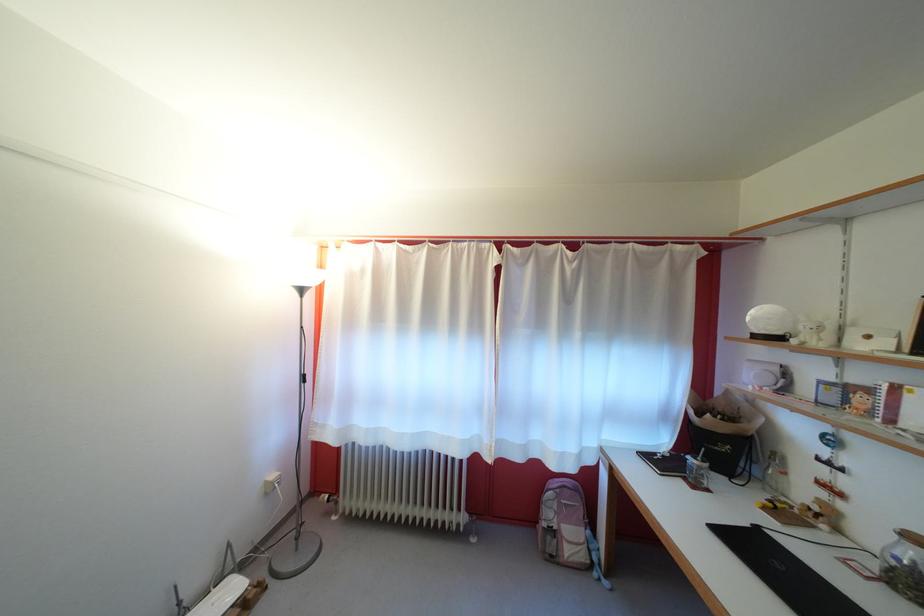
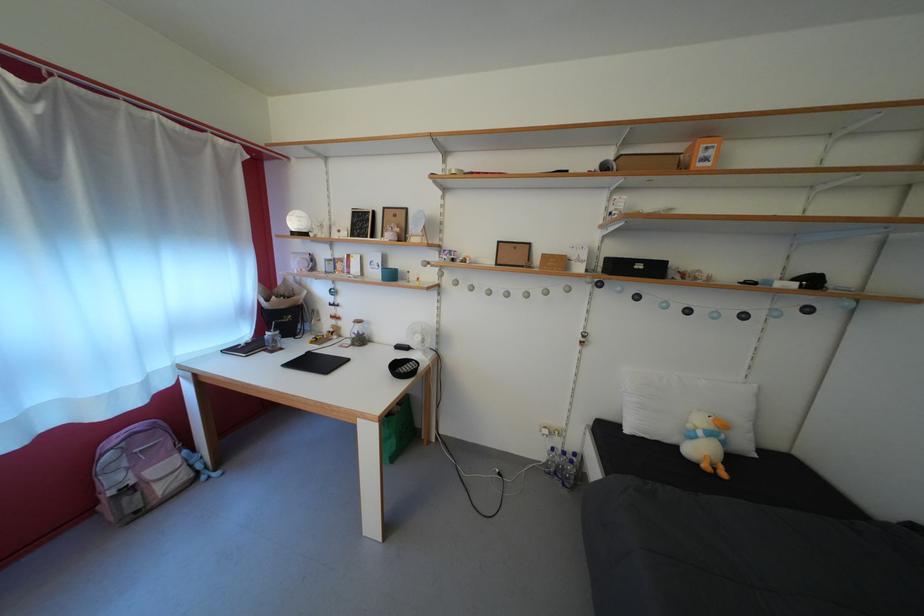
Locate, in the second image, the point that corresponds to (x=882, y=541) in the first image.

(358, 334)